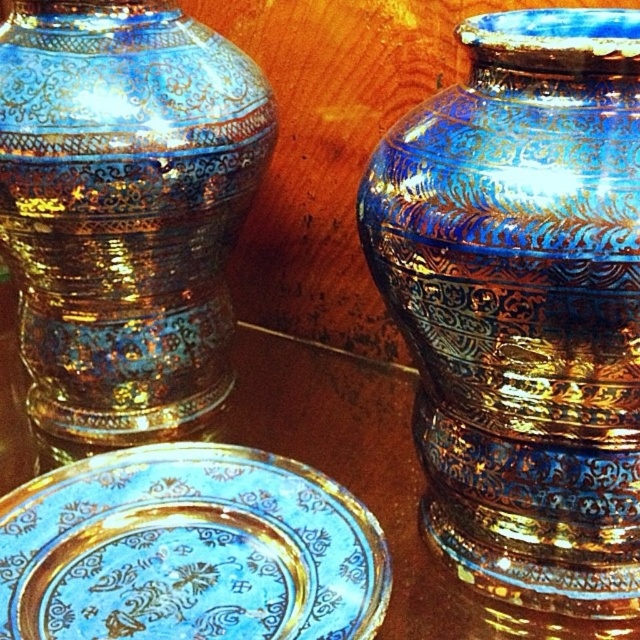
You are an art curator arranging a display of ceramics. You have two points marked on the layout plan for placing items. The first point is at coordinate point (604, 280) and the second is at coordinate point (564, 627). According to the scene, which point is closer to the viewer when setting up the display?

Point (604, 280) is closer to the viewer than point (564, 627) based on the description provided.